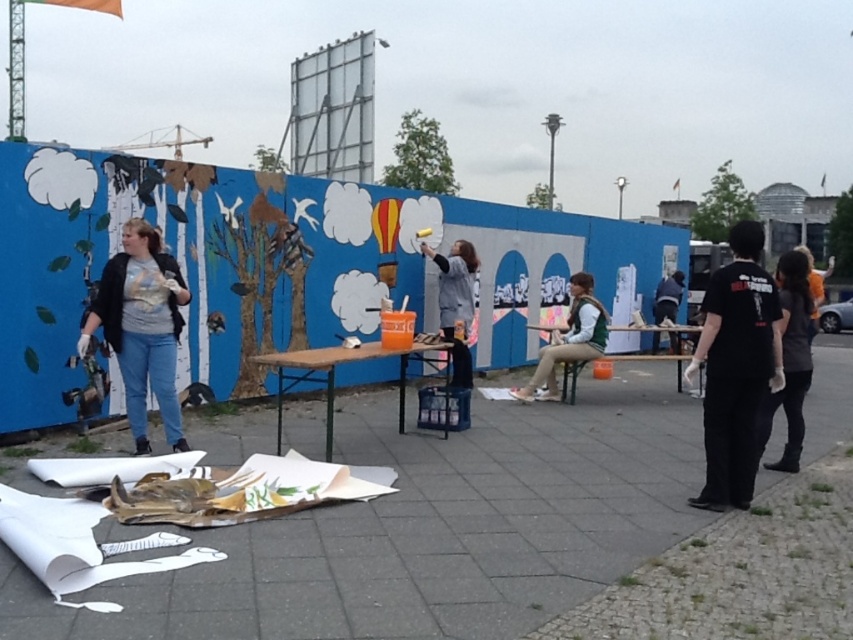
Question: Can you confirm if matte gray shirt at left is smaller than green textured vest at center?

Choices:
 (A) no
 (B) yes

Answer: (B)

Question: Estimate the real-world distances between objects in this image. Which object is closer to the green textured vest at center?

Choices:
 (A) black matte shirt at right
 (B) dark gray shirt at right

Answer: (B)

Question: Is matte gray shirt at left to the left of green textured vest at center from the viewer's perspective?

Choices:
 (A) yes
 (B) no

Answer: (A)

Question: Is matte gray shirt at left wider than dark gray shirt at right?

Choices:
 (A) yes
 (B) no

Answer: (A)

Question: Which point is closer to the camera?

Choices:
 (A) (578, 292)
 (B) (741, 230)

Answer: (B)

Question: Which object is the farthest from the matte gray shirt at left?

Choices:
 (A) dark gray shirt at right
 (B) black matte shirt at right

Answer: (A)